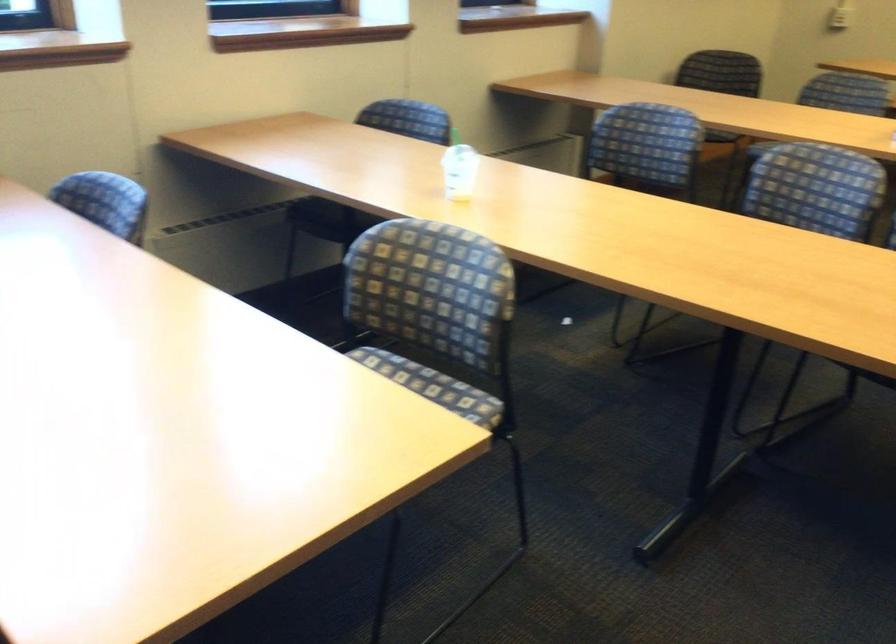
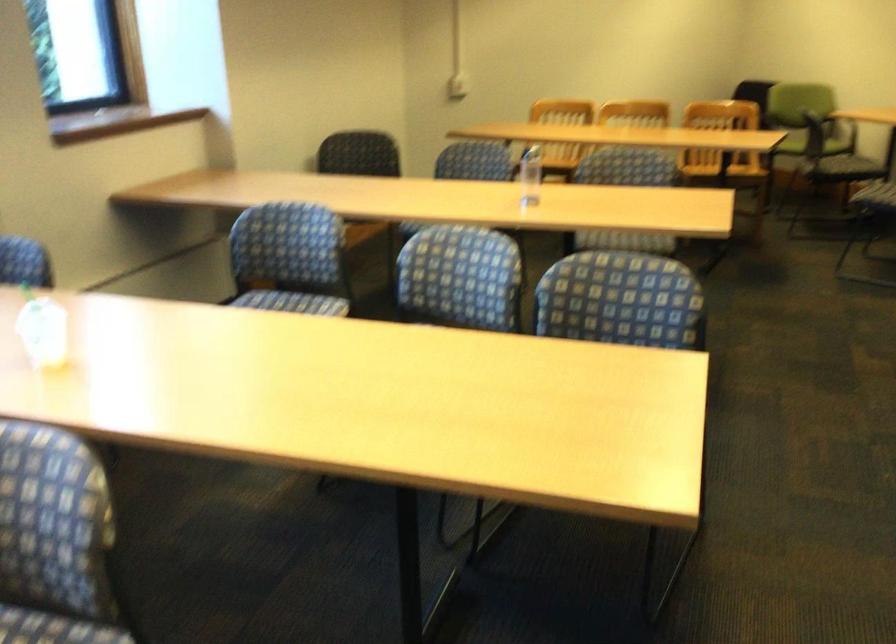
Question: The images are taken continuously from a first-person perspective. In which direction is your viewpoint rotating?

Choices:
 (A) Left
 (B) Right
 (C) Up
 (D) Down

Answer: (B)